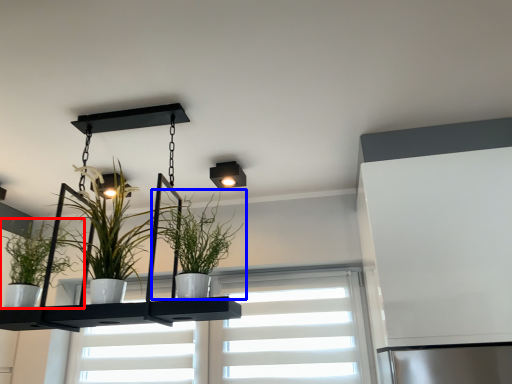
Question: Which point is closer to the camera, houseplant (highlighted by a red box) or houseplant (highlighted by a blue box)?

Choices:
 (A) houseplant
 (B) houseplant

Answer: (B)